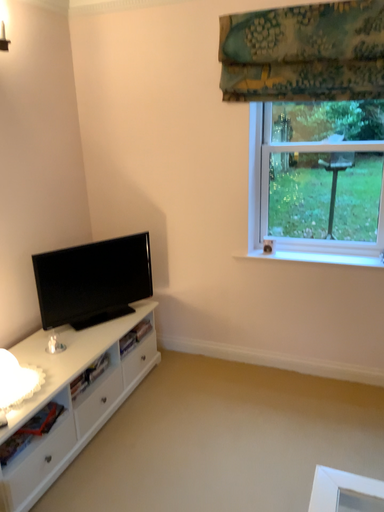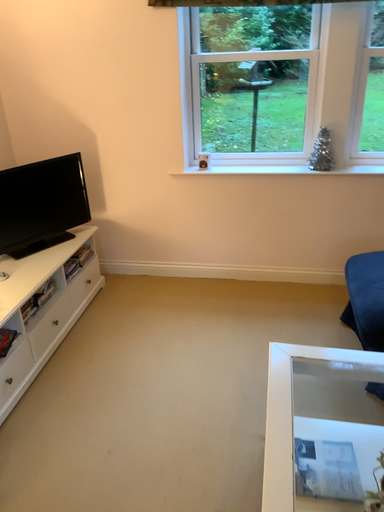
Question: Which way did the camera rotate in the video?

Choices:
 (A) rotated downward
 (B) rotated upward

Answer: (A)